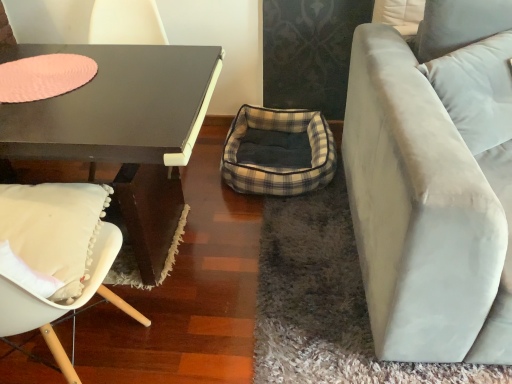
Question: Could you tell me if white fabric pillow at upper right is facing pink felt placemat at upper left?

Choices:
 (A) no
 (B) yes

Answer: (A)

Question: Is white fabric pillow at upper right directly adjacent to pink felt placemat at upper left?

Choices:
 (A) yes
 (B) no

Answer: (B)

Question: Considering the relative sizes of white fabric pillow at upper right and pink felt placemat at upper left in the image provided, is white fabric pillow at upper right smaller than pink felt placemat at upper left?

Choices:
 (A) no
 (B) yes

Answer: (A)

Question: From the image's perspective, is white fabric pillow at upper right below pink felt placemat at upper left?

Choices:
 (A) yes
 (B) no

Answer: (B)

Question: From the image's perspective, is white fabric pillow at upper right on pink felt placemat at upper left?

Choices:
 (A) yes
 (B) no

Answer: (A)

Question: Is matte black coffee table at left bigger or smaller than plaid fabric bean bag at center?

Choices:
 (A) big
 (B) small

Answer: (A)

Question: Relative to plaid fabric bean bag at center, is matte black coffee table at left in front or behind?

Choices:
 (A) behind
 (B) front

Answer: (B)

Question: From the image's perspective, is matte black coffee table at left positioned above or below plaid fabric bean bag at center?

Choices:
 (A) below
 (B) above

Answer: (A)

Question: Considering the relative positions of matte black coffee table at left and plaid fabric bean bag at center in the image provided, is matte black coffee table at left to the left or to the right of plaid fabric bean bag at center?

Choices:
 (A) right
 (B) left

Answer: (B)

Question: Do you think matte black coffee table at left is within light beige fabric couch at right, or outside of it?

Choices:
 (A) inside
 (B) outside

Answer: (B)

Question: Is matte black coffee table at left taller or shorter than light beige fabric couch at right?

Choices:
 (A) tall
 (B) short

Answer: (B)

Question: Is matte black coffee table at left wider or thinner than light beige fabric couch at right?

Choices:
 (A) thin
 (B) wide

Answer: (A)

Question: Based on their sizes in the image, would you say matte black coffee table at left is bigger or smaller than light beige fabric couch at right?

Choices:
 (A) big
 (B) small

Answer: (B)

Question: From the image's perspective, relative to matte black coffee table at left, is plaid fabric bean bag at center above or below?

Choices:
 (A) below
 (B) above

Answer: (B)

Question: In the image, is plaid fabric bean bag at center on the left side or the right side of matte black coffee table at left?

Choices:
 (A) right
 (B) left

Answer: (A)